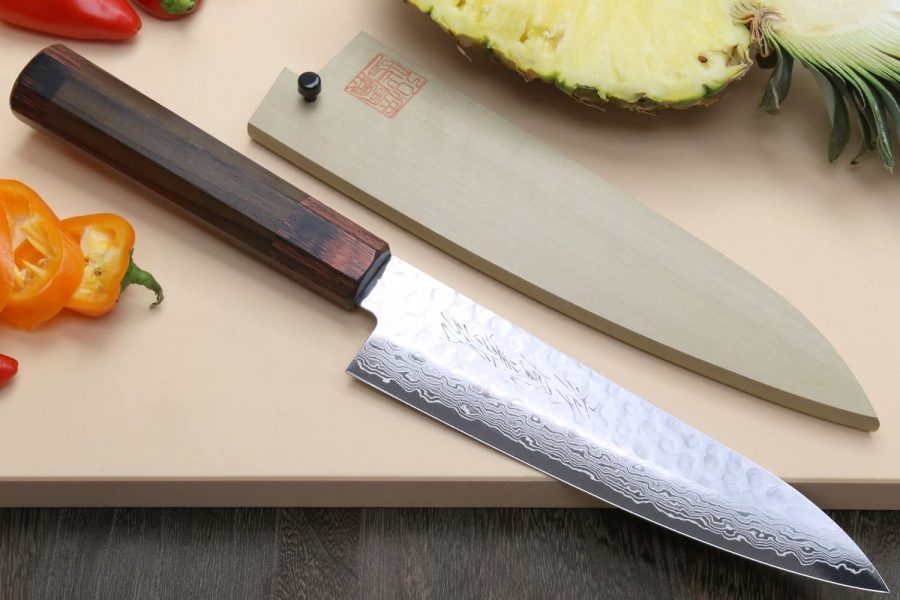
This screenshot has height=600, width=900. What are the coordinates of `fancy decoration` in the screenshot? It's located at tap(726, 520), tap(460, 396).